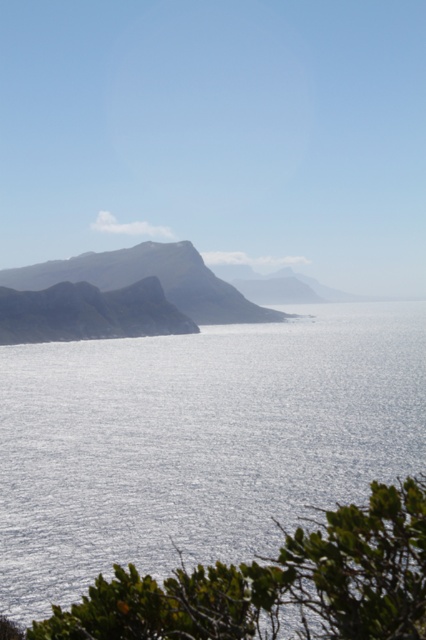
You are standing at the edge of the water and see the green leafy shrub at lower right and the smooth gray rock at center. Which object is closer to the water?

The green leafy shrub at lower right is closer to the water because it is positioned below the smooth gray rock at center, meaning it is situated lower in the scene.

You are a hiker standing at the edge of the coastal landscape. You see the glistening silver water at center and the smooth gray rock at center. Which object is closer to you?

The glistening silver water at center is closer to you because it is in front of the smooth gray rock at center.

You are standing at the point labeled point (106, 493) and want to walk to the point labeled point (181, 312). Based on the scene description, which direction should you move to reach your destination?

You should move away from the camera because point (181, 312) is further from the camera than point (106, 493).